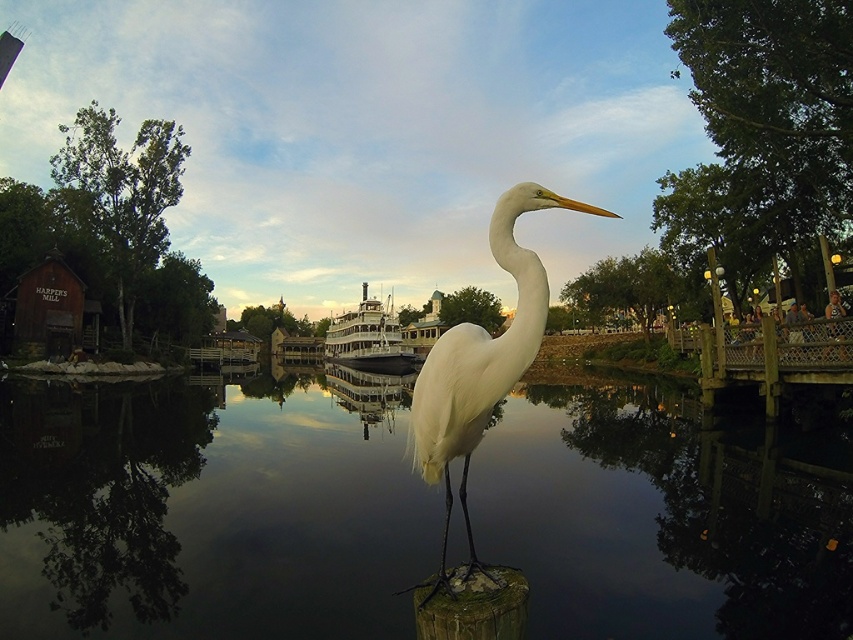
You are a photographer trying to capture the white heron on the wooden post. You notice the transparent water at center and the polished wood boat at center. Which object is closer to the heron?

The polished wood boat at center is closer to the heron because the transparent water at center is to the right of the boat, meaning the boat is between the heron and the water.

You are an ornithologist observing the white feathered bird at center and the polished wood boat at center in the image. Which object is smaller in size?

The white feathered bird at center is smaller in size compared to the polished wood boat at center.